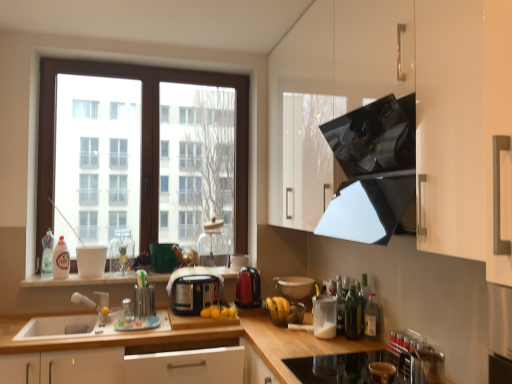
The width and height of the screenshot is (512, 384). In order to click on vacant area on the back side of wooden bowl at lower center, placed as the 3th appliance when sorted from front to back in this screenshot , I will do `click(359, 372)`.